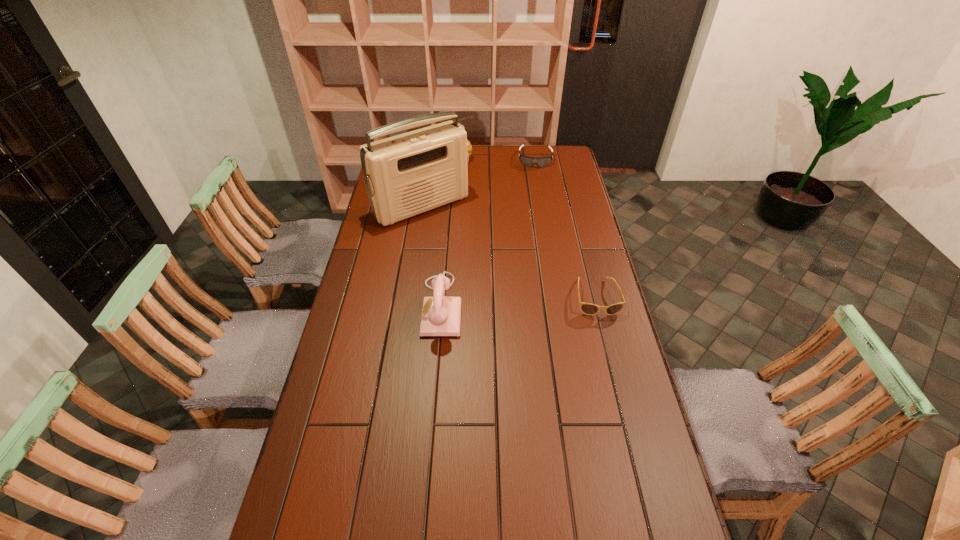
Identify the location of the second tallest object. (441, 315).

The height and width of the screenshot is (540, 960). Identify the location of sunglasses. (587, 308).

The height and width of the screenshot is (540, 960). Find the location of `goggles`. goggles is located at coordinates (528, 161).

Image resolution: width=960 pixels, height=540 pixels. What are the coordinates of `radio receiver` in the screenshot? It's located at (405, 175).

Identify the location of the third farthest object. (405, 175).

At what (x,y) coordinates should I click in order to perform the action: click on gourd. Please return your answer as a coordinate pair (x, y). This screenshot has width=960, height=540. Looking at the image, I should click on (469, 147).

Identify the location of vacant space positioned on the dial of the fourth shortest object. (349, 306).

At what (x,y) coordinates should I click in order to perform the action: click on vacant point located 0.240m on the dial of the fourth shortest object. Please return your answer as a coordinate pair (x, y). The width and height of the screenshot is (960, 540). Looking at the image, I should click on (352, 306).

Identify the location of free space located 0.200m on the dial of the fourth shortest object. This screenshot has width=960, height=540. (364, 306).

Locate an element on the screen. blank area located 0.100m on the front-facing side of the sunglasses is located at coordinates (607, 340).